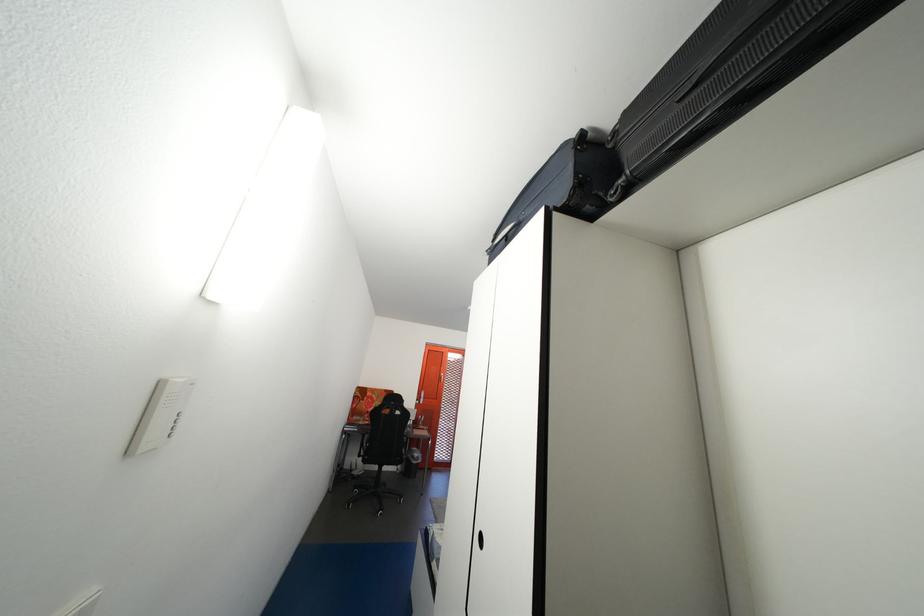
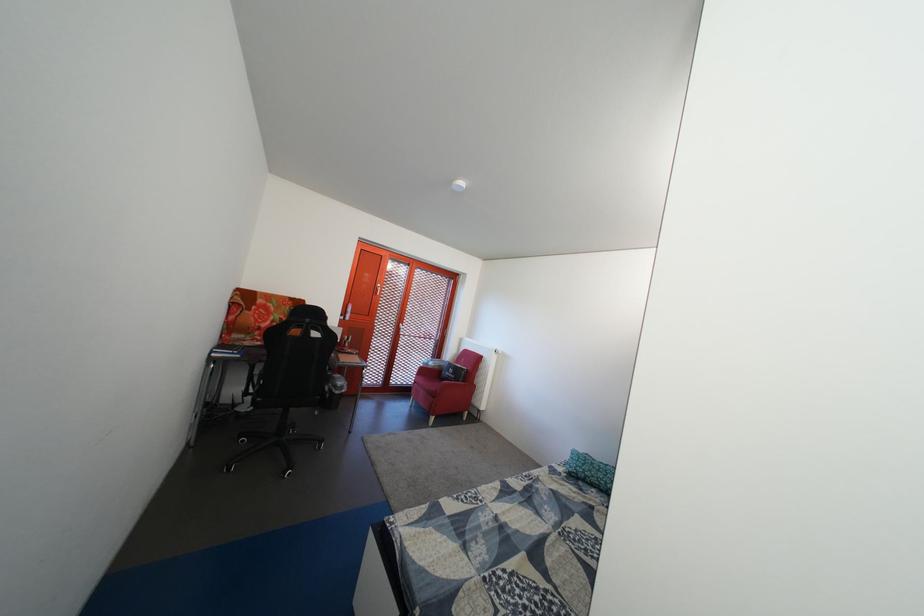
What movement of the cameraman would produce the second image?

The cameraman moved toward left, forward.